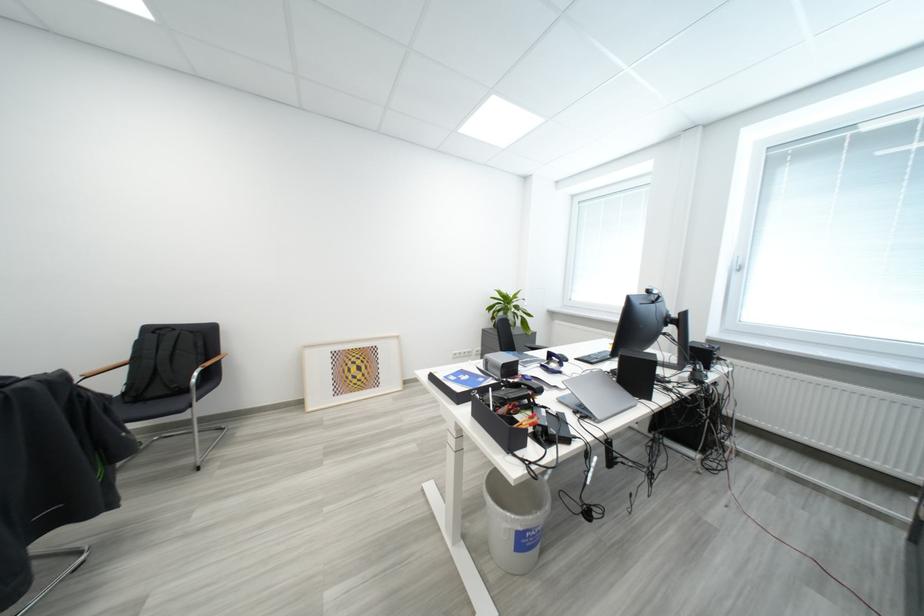
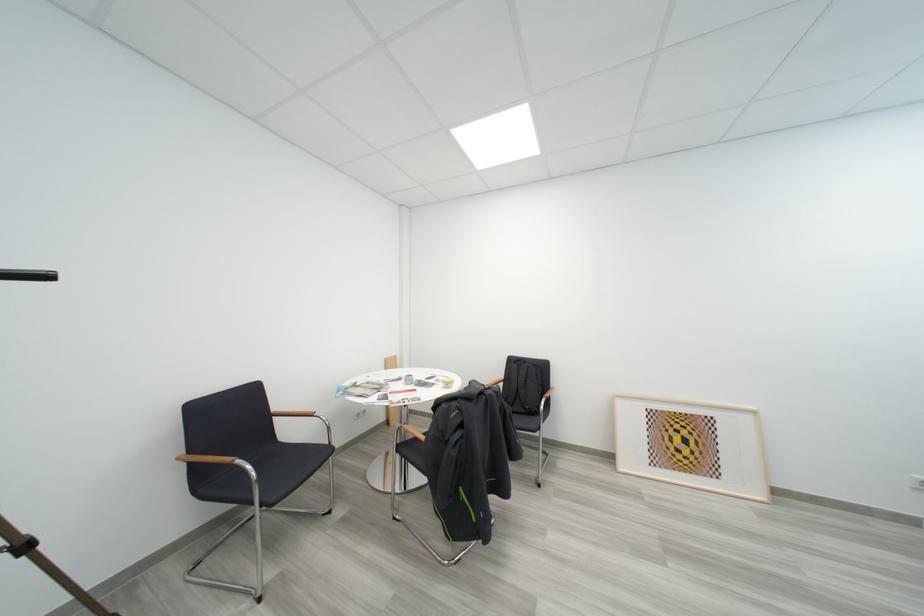
The point at (x=135, y=361) is marked in the first image. Where is the corresponding point in the second image?

(512, 381)